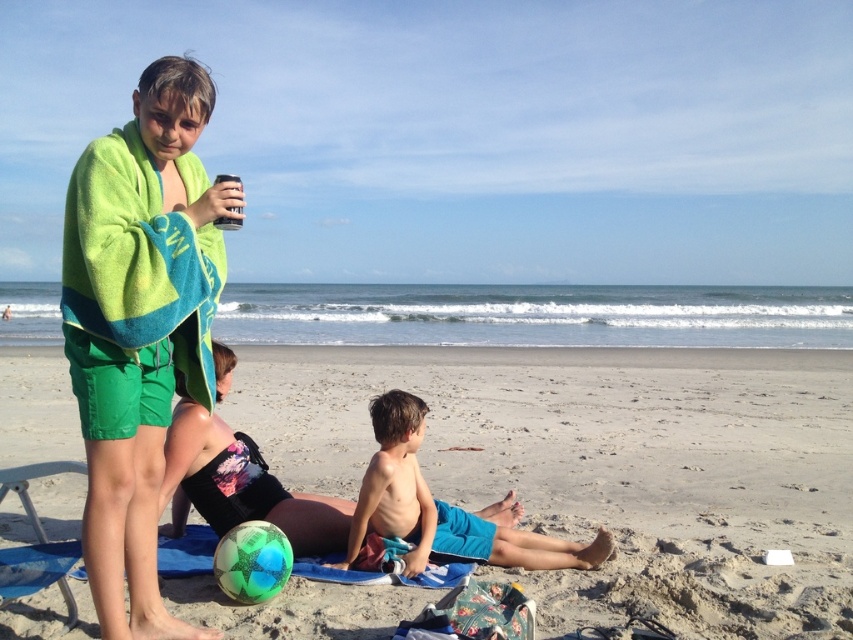
Can you confirm if sandy beach at lower center is positioned below smooth skin boy at center?

Indeed, sandy beach at lower center is positioned under smooth skin boy at center.

Is sandy beach at lower center wider than smooth skin boy at center?

Correct, the width of sandy beach at lower center exceeds that of smooth skin boy at center.

Is point (223, 600) positioned in front of point (357, 563)?

Yes, point (223, 600) is closer to viewer.

Find the location of a particular element. The image size is (853, 640). sandy beach at lower center is located at coordinates (605, 467).

From the picture: Who is lower down, black fabric bikini bottom at lower left or black plastic can at upper center?

black fabric bikini bottom at lower left is lower down.

Is black fabric bikini bottom at lower left above black plastic can at upper center?

No.

Where is `black fabric bikini bottom at lower left`? The image size is (853, 640). black fabric bikini bottom at lower left is located at coordinates (351, 500).

The image size is (853, 640). I want to click on black fabric bikini bottom at lower left, so coord(351,500).

Is smooth skin boy at center above black plastic can at upper center?

No, smooth skin boy at center is not above black plastic can at upper center.

Is smooth skin boy at center closer to the viewer compared to black plastic can at upper center?

No, it is not.

Find the location of a particular element. This screenshot has height=640, width=853. smooth skin boy at center is located at coordinates (392, 490).